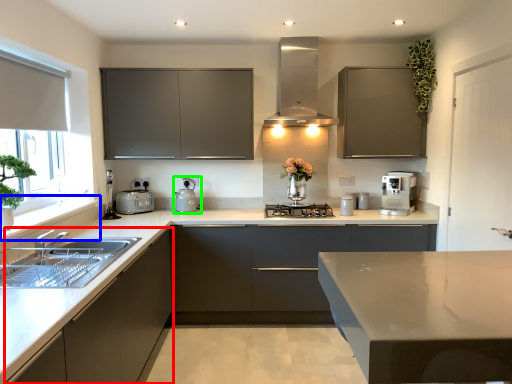
Question: Which object is positioned farthest from cabinetry (highlighted by a red box)? Select from window sill (highlighted by a blue box) and appliance (highlighted by a green box).

Choices:
 (A) window sill
 (B) appliance

Answer: (B)